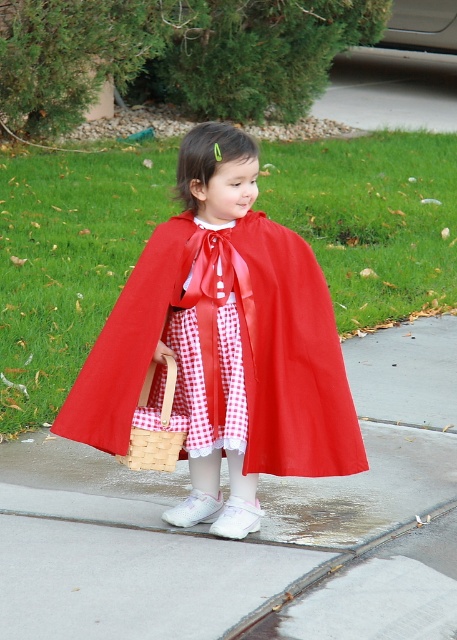
Can you confirm if smooth concrete pavement at center is thinner than woven wood basket at center?

In fact, smooth concrete pavement at center might be wider than woven wood basket at center.

Where is `smooth concrete pavement at center`? The width and height of the screenshot is (457, 640). smooth concrete pavement at center is located at coordinates (251, 536).

Which is in front, point (99, 577) or point (143, 436)?

Point (99, 577)

Identify the location of smooth concrete pavement at center. Image resolution: width=457 pixels, height=640 pixels. (251, 536).

Can you confirm if smooth concrete pavement at center is positioned above red checkered fabric dress at center?

Actually, smooth concrete pavement at center is below red checkered fabric dress at center.

Which of these two, smooth concrete pavement at center or red checkered fabric dress at center, stands shorter?

Standing shorter between the two is smooth concrete pavement at center.

Locate an element on the screen. Image resolution: width=457 pixels, height=640 pixels. smooth concrete pavement at center is located at coordinates (251, 536).

Who is positioned more to the left, red checkered fabric dress at center or woven wood basket at center?

woven wood basket at center

Can you confirm if red checkered fabric dress at center is positioned to the left of woven wood basket at center?

No, red checkered fabric dress at center is not to the left of woven wood basket at center.

Is point (157, 275) less distant than point (181, 436)?

Yes.

Find the location of a particular element. red checkered fabric dress at center is located at coordinates (293, 360).